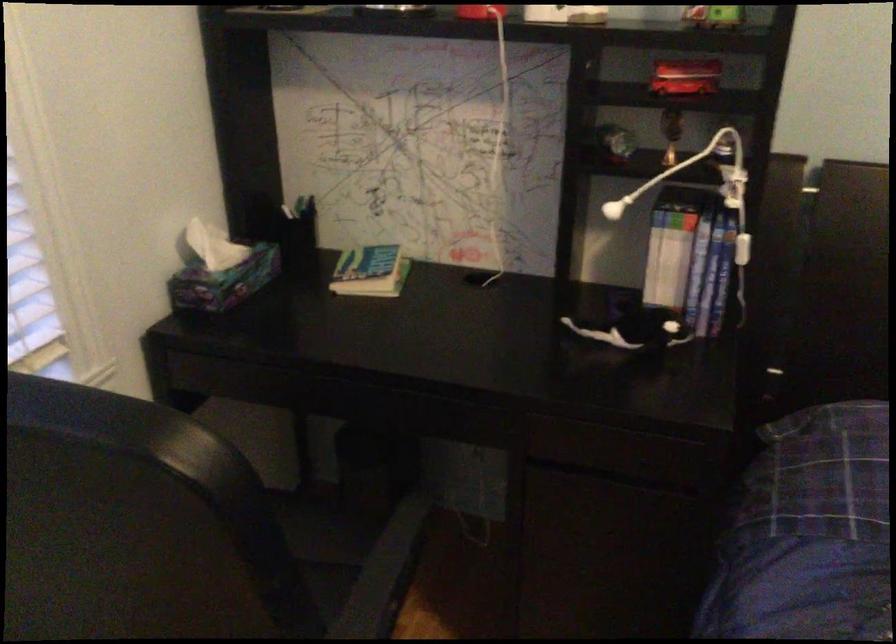
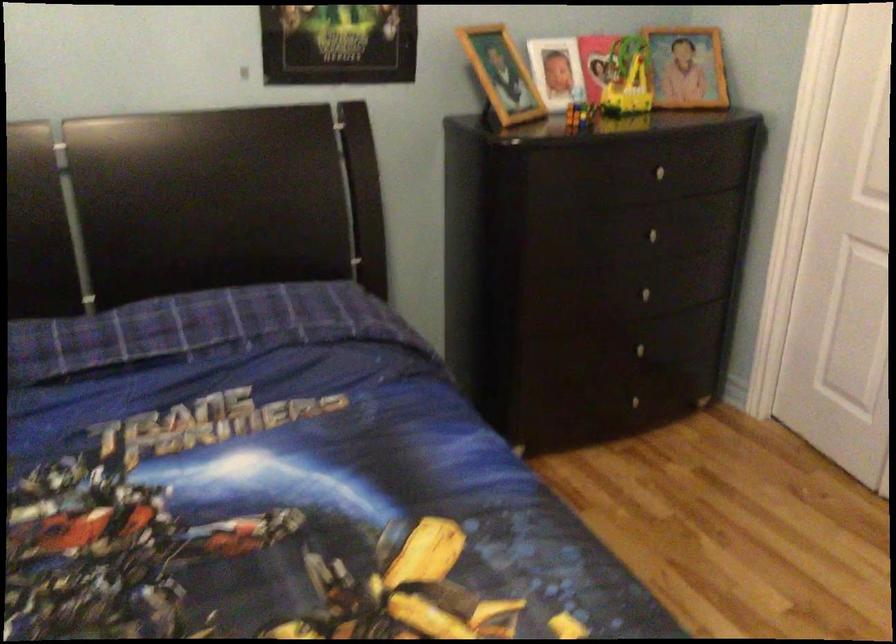
Question: The first image is from the beginning of the video and the second image is from the end. How did the camera likely rotate when shooting the video?

Choices:
 (A) Left
 (B) Right
 (C) Up
 (D) Down

Answer: (B)